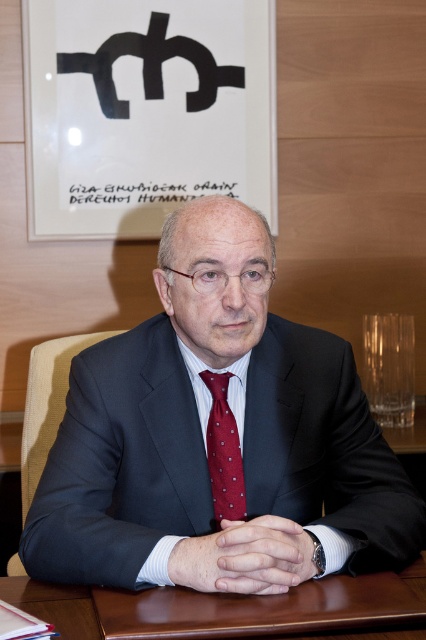
Looking at this image, what are the coordinates of the brown wooden table at center?

The brown wooden table at center is located at point (224,605).

What is the significance of the point at coordinates (224,452) in the image?

The point at coordinates (224,452) indicates the location of the polished silk tie at center.